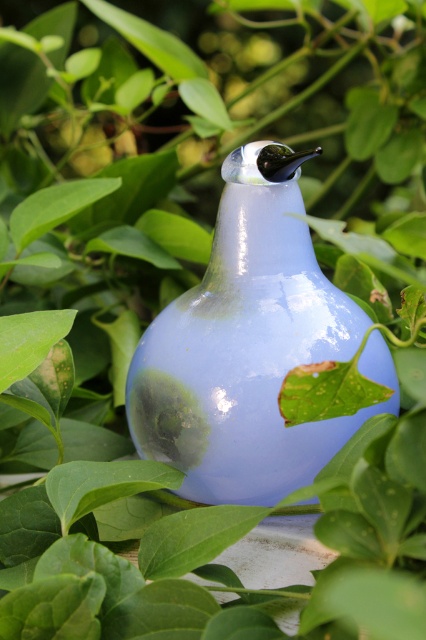
Question: Can you confirm if green glossy leaf at upper left is bigger than green matte leaf at lower left?

Choices:
 (A) yes
 (B) no

Answer: (A)

Question: Is translucent glass vase at center positioned before green matte leaf at lower left?

Choices:
 (A) yes
 (B) no

Answer: (B)

Question: Can you confirm if green glossy leaf at upper left is thinner than green matte leaf at lower left?

Choices:
 (A) no
 (B) yes

Answer: (A)

Question: Which object is positioned farthest from the green glossy leaf at lower left?

Choices:
 (A) green glossy leaf at upper left
 (B) green matte leaf at lower left
 (C) translucent glass vase at center

Answer: (A)

Question: Which point is farther to the camera?

Choices:
 (A) (178, 476)
 (B) (48, 308)

Answer: (B)

Question: Considering the real-world distances, which object is closest to the green matte leaf at lower left?

Choices:
 (A) green glossy leaf at upper left
 (B) green glossy leaf at lower left
 (C) translucent glass vase at center

Answer: (B)